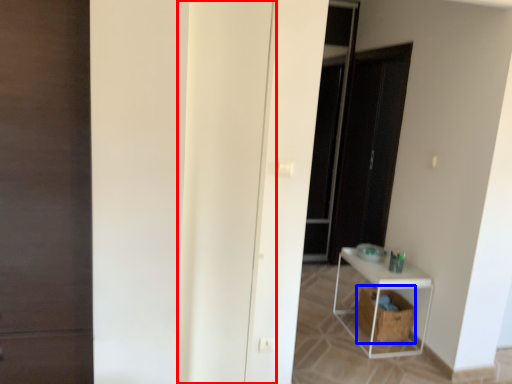
Question: Which of the following is the closest to the observer, door (highlighted by a red box) or laundry basket (highlighted by a blue box)?

Choices:
 (A) door
 (B) laundry basket

Answer: (A)